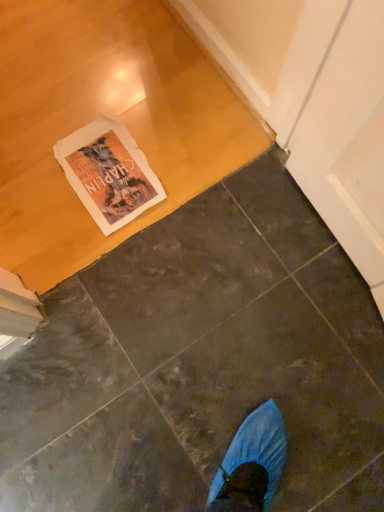
Where is `free space below white paper magazine at upper left (from a real-world perspective)`? free space below white paper magazine at upper left (from a real-world perspective) is located at coordinates (99, 161).